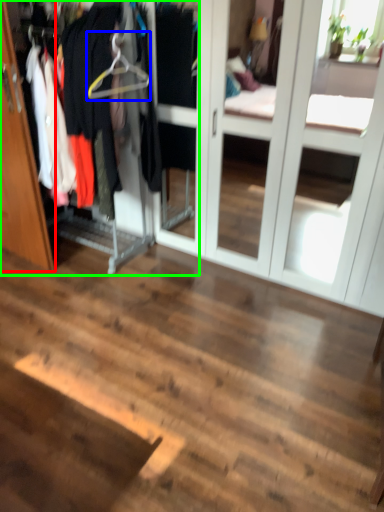
Question: Which object is positioned closest to door (highlighted by a red box)? Select from hanger (highlighted by a blue box) and closet (highlighted by a green box).

Choices:
 (A) hanger
 (B) closet

Answer: (B)